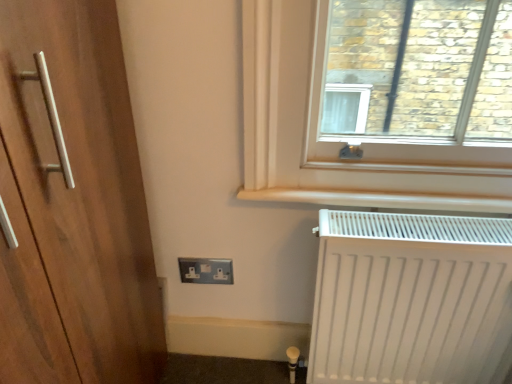
Question: Is black plastic outlet at lower center outside white matte radiator at lower right?

Choices:
 (A) yes
 (B) no

Answer: (A)

Question: Is black plastic outlet at lower center at the left side of white matte radiator at lower right?

Choices:
 (A) yes
 (B) no

Answer: (A)

Question: Does black plastic outlet at lower center have a smaller size compared to white matte radiator at lower right?

Choices:
 (A) no
 (B) yes

Answer: (B)

Question: From a real-world perspective, does black plastic outlet at lower center sit lower than white matte radiator at lower right?

Choices:
 (A) yes
 (B) no

Answer: (A)

Question: Is black plastic outlet at lower center bigger than white matte radiator at lower right?

Choices:
 (A) yes
 (B) no

Answer: (B)

Question: Is black plastic outlet at lower center positioned before white matte radiator at lower right?

Choices:
 (A) no
 (B) yes

Answer: (A)

Question: Considering the relative positions of white matte radiator at lower right and black plastic outlet at lower center in the image provided, is white matte radiator at lower right to the right of black plastic outlet at lower center from the viewer's perspective?

Choices:
 (A) no
 (B) yes

Answer: (B)

Question: From a real-world perspective, is white matte radiator at lower right positioned under black plastic outlet at lower center based on gravity?

Choices:
 (A) yes
 (B) no

Answer: (B)

Question: Is white matte radiator at lower right not near black plastic outlet at lower center?

Choices:
 (A) no
 (B) yes

Answer: (A)

Question: Considering the relative positions of white matte radiator at lower right and black plastic outlet at lower center in the image provided, is white matte radiator at lower right behind black plastic outlet at lower center?

Choices:
 (A) yes
 (B) no

Answer: (B)

Question: Can you confirm if white matte radiator at lower right is thinner than black plastic outlet at lower center?

Choices:
 (A) no
 (B) yes

Answer: (A)

Question: Considering the relative sizes of white matte radiator at lower right and black plastic outlet at lower center in the image provided, is white matte radiator at lower right taller than black plastic outlet at lower center?

Choices:
 (A) no
 (B) yes

Answer: (B)

Question: From the image's perspective, is white matte radiator at lower right above or below black plastic outlet at lower center?

Choices:
 (A) below
 (B) above

Answer: (A)